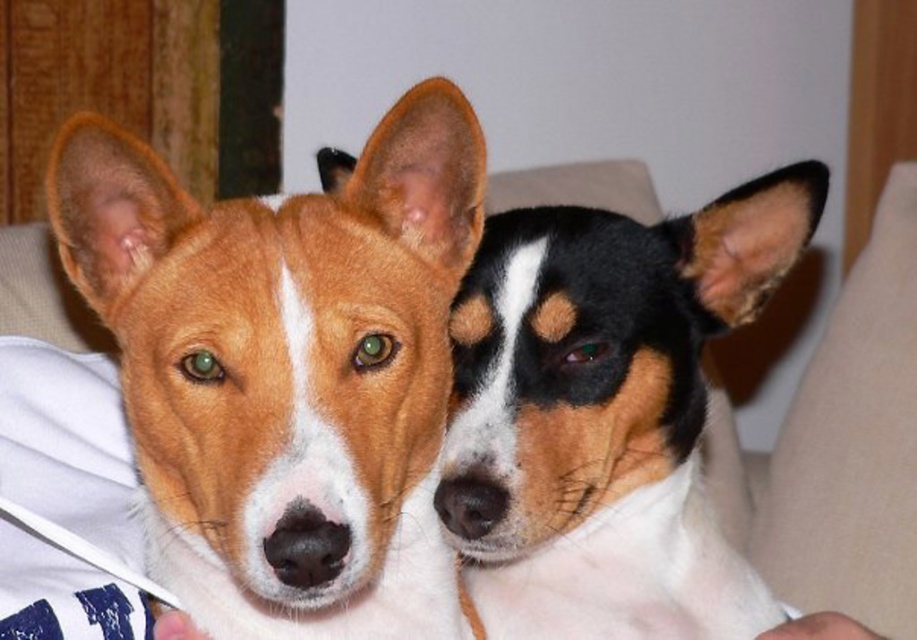
You are standing in front of a wooden door frame and see the brown fur dog at left and the black and white fur at center. Which dog is positioned closer to the door frame?

The brown fur dog at left is closer to the door frame because it is positioned to the left of the black and white fur at center, and the door frame is on the left side of the image.

You are a dog trainer assessing the size of the dogs in the image. Which dog is bigger between the brown fur dog at left and the black and white fur at center?

The black and white fur at center is bigger than the brown fur dog at left.

You are a dog trainer assessing the space needed for two dogs. The brown fur dog at left requires a minimum of 1 meter of space. Can the black and white fur at center fit in the same space?

The brown fur dog at left is narrower than the black and white fur at center. Since the black and white fur at center is wider, it would need more space than the 1 meter allocated for the brown fur dog at left. Therefore, the black and white fur at center cannot fit in the same 1 meter space.